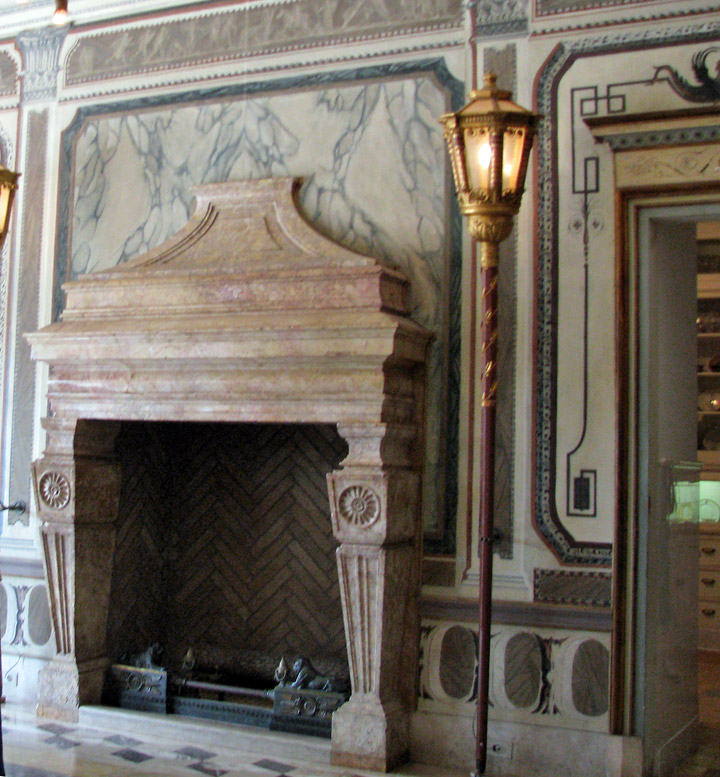
You are a GUI agent. You are given a task and a screenshot of the screen. Output one action in this format:
    pyautogui.click(x=<x>, y=<y>)
    Task: Click on the decoration
    The height and width of the screenshot is (777, 720).
    Given the screenshot: What is the action you would take?
    pyautogui.click(x=625, y=312), pyautogui.click(x=585, y=175)